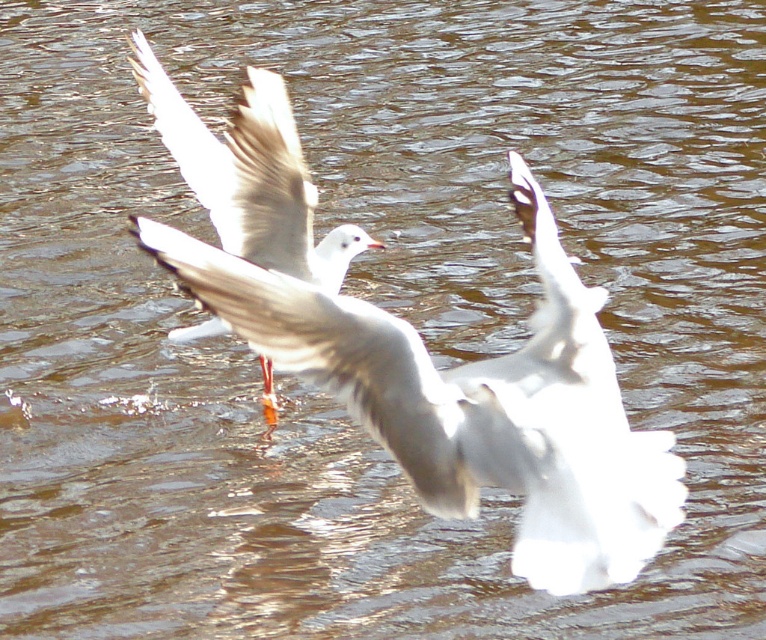
Between white feathered wing at center and white feathered bird at center, which one appears on the left side from the viewer's perspective?

white feathered bird at center

Based on the photo, does white feathered wing at center have a larger size compared to white feathered bird at center?

Incorrect, white feathered wing at center is not larger than white feathered bird at center.

What do you see at coordinates (336, 356) in the screenshot?
I see `white feathered wing at center` at bounding box center [336, 356].

The width and height of the screenshot is (766, 640). Identify the location of white feathered wing at center. (336, 356).